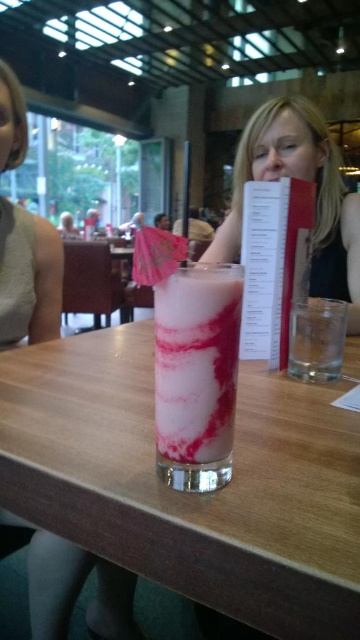
Question: Can you confirm if matte white dress at center is positioned to the left of swirled pink milkshake at center?

Choices:
 (A) yes
 (B) no

Answer: (A)

Question: Estimate the real-world distances between objects in this image. Which object is closer to the swirled pink milkshake at center?

Choices:
 (A) clear glass at right
 (B) matte white dress at center
 (C) smooth black hair at upper center

Answer: (A)

Question: Does smooth black hair at upper center appear under white paper menu at center?

Choices:
 (A) yes
 (B) no

Answer: (B)

Question: Which of the following is the farthest from the observer?

Choices:
 (A) (25, 243)
 (B) (282, 145)
 (C) (316, 492)

Answer: (B)

Question: Is white paper menu at center behind clear glass at right?

Choices:
 (A) no
 (B) yes

Answer: (B)

Question: Which of the following is the closest to the observer?

Choices:
 (A) smooth black hair at upper center
 (B) white paper menu at center
 (C) matte white dress at center

Answer: (C)